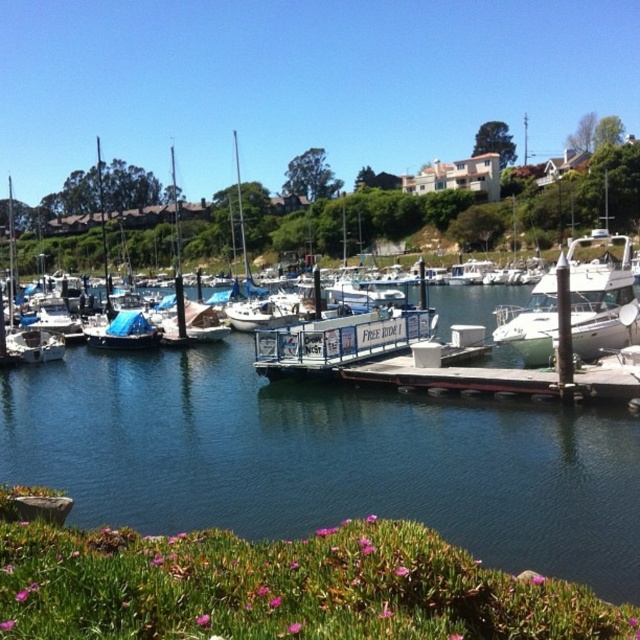
You are planning to take a photo of the white matte sailboat at left and the blue painted metal dock at center. Which object should you focus on first if you want to capture both in a single frame without adjusting your camera angle?

You should focus on the white matte sailboat at left first because it is taller than the blue painted metal dock at center, ensuring it fits within the frame when capturing both objects together.

You are standing on the dock and see the clear blue water at center and the white matte sailboat at left. Which object is positioned to the right of the other?

The clear blue water at center is to the right of the white matte sailboat at left.

Looking at this image, you are standing on the dock and want to compare the heights of the clear blue water at center and the white matte sailboat at left. Which one has a greater height?

The white matte sailboat at left has a greater height than the clear blue water at center.